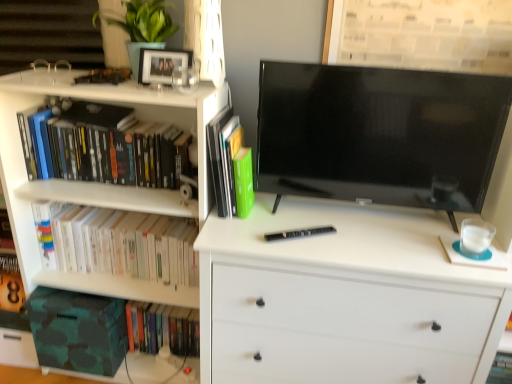
Question: Considering the relative sizes of black matte pen at center and green matte book at center, which is counted as the 2th book, starting from the top, in the image provided, is black matte pen at center shorter than green matte book at center, which is counted as the 2th book, starting from the top,?

Choices:
 (A) yes
 (B) no

Answer: (A)

Question: Considering the relative sizes of black matte pen at center and green matte book at center, which is the third book from bottom to top, in the image provided, is black matte pen at center wider than green matte book at center, which is the third book from bottom to top,?

Choices:
 (A) yes
 (B) no

Answer: (A)

Question: Is green matte book at center, which is the third book from bottom to top, completely or partially inside black matte pen at center?

Choices:
 (A) yes
 (B) no

Answer: (B)

Question: Is there a large distance between black matte pen at center and green matte book at center, which is the third book from bottom to top?

Choices:
 (A) no
 (B) yes

Answer: (A)

Question: Considering the relative positions of black matte pen at center and green matte book at center, which is counted as the 2th book, starting from the top, in the image provided, is black matte pen at center to the left of green matte book at center, which is counted as the 2th book, starting from the top, from the viewer's perspective?

Choices:
 (A) yes
 (B) no

Answer: (B)

Question: Is point (134, 317) positioned closer to the camera than point (403, 309)?

Choices:
 (A) farther
 (B) closer

Answer: (A)

Question: From the image's perspective, is hardcover book at lower left, which is the 1th book in bottom-to-top order, above or below white matte chest of drawers at center?

Choices:
 (A) below
 (B) above

Answer: (A)

Question: In terms of width, does hardcover book at lower left, which is the 1th book in bottom-to-top order, look wider or thinner when compared to white matte chest of drawers at center?

Choices:
 (A) thin
 (B) wide

Answer: (A)

Question: From a real-world perspective, is hardcover book at lower left, which is the 1th book in bottom-to-top order, physically located above or below white matte chest of drawers at center?

Choices:
 (A) below
 (B) above

Answer: (A)

Question: Looking at their shapes, would you say green matte book at center, which is the third book from bottom to top, is wider or thinner than white matte chest of drawers at center?

Choices:
 (A) wide
 (B) thin

Answer: (B)

Question: Is green matte book at center, which is the third book from bottom to top, in front of or behind white matte chest of drawers at center in the image?

Choices:
 (A) front
 (B) behind

Answer: (B)

Question: Is green matte book at center, which is the third book from bottom to top, taller or shorter than white matte chest of drawers at center?

Choices:
 (A) tall
 (B) short

Answer: (B)

Question: Is point (228, 142) positioned closer to the camera than point (475, 291)?

Choices:
 (A) closer
 (B) farther

Answer: (B)

Question: Choose the correct answer: Is camouflage fabric storage box at lower left inside green matte book at center, which is counted as the 2th book, starting from the top, or outside it?

Choices:
 (A) outside
 (B) inside

Answer: (A)

Question: From a real-world perspective, is camouflage fabric storage box at lower left above or below green matte book at center, which is the third book from bottom to top?

Choices:
 (A) above
 (B) below

Answer: (B)